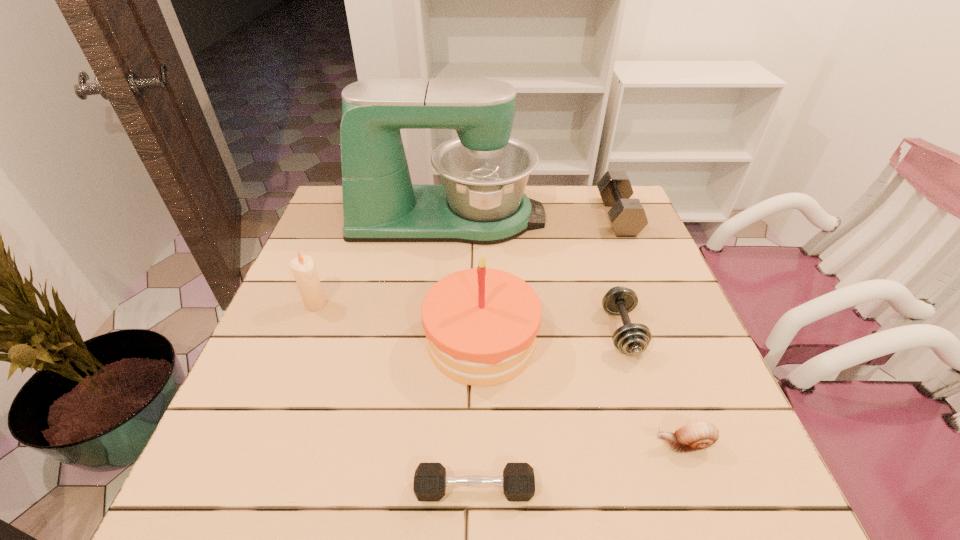
The width and height of the screenshot is (960, 540). I want to click on vacant region that satisfies the following two spatial constraints: 1. on the front-facing side of the escargot; 2. on the front side of the nearest dumbbell, so pyautogui.click(x=699, y=489).

Identify the location of vacant space that satisfies the following two spatial constraints: 1. on the front-facing side of the mixer; 2. on the front side of the third tallest object. Image resolution: width=960 pixels, height=540 pixels. (x=440, y=304).